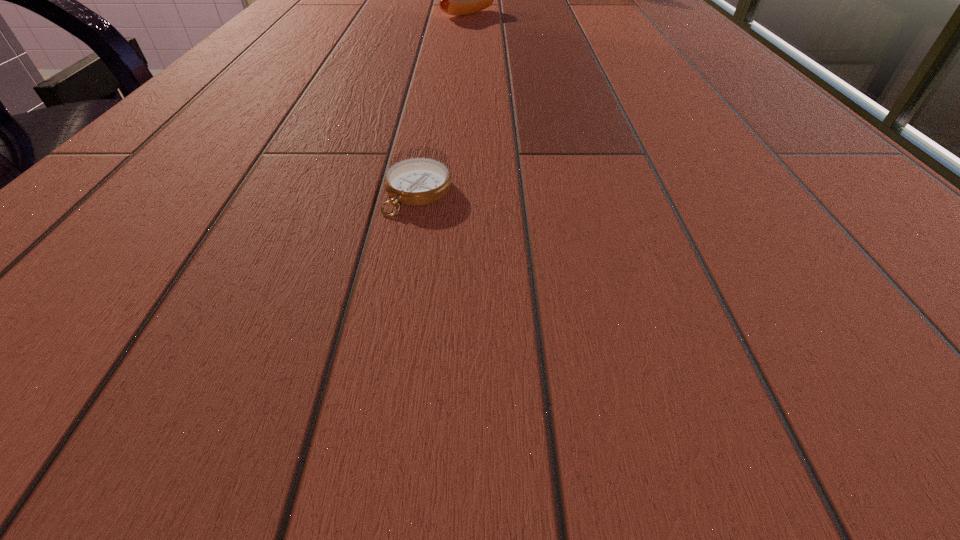
Where is `the farther object`? This screenshot has width=960, height=540. the farther object is located at coordinates (455, 0).

Locate an element on the screen. sausage is located at coordinates (455, 0).

Where is `the nearer object`? the nearer object is located at coordinates (416, 181).

In order to click on compass in this screenshot , I will do `click(416, 181)`.

Locate an element on the screen. The image size is (960, 540). free spot located on the right of the taller object is located at coordinates 572,14.

This screenshot has width=960, height=540. Find the location of `vacant space located on the back of the nearer object`. vacant space located on the back of the nearer object is located at coordinates (440, 65).

The width and height of the screenshot is (960, 540). I want to click on vacant space at the near edge of the desktop, so click(x=294, y=417).

You are a GUI agent. You are given a task and a screenshot of the screen. Output one action in this format:
    pyautogui.click(x=<x>, y=<y>)
    Task: Click on the vacant space at the left edge of the desktop
    Image resolution: width=960 pixels, height=540 pixels.
    Given the screenshot: What is the action you would take?
    pyautogui.click(x=297, y=6)

The height and width of the screenshot is (540, 960). I want to click on blank space at the right edge of the desktop, so click(x=833, y=281).

The width and height of the screenshot is (960, 540). Find the location of `vacant area that lies between the shorter object and the sausage`. vacant area that lies between the shorter object and the sausage is located at coordinates (443, 103).